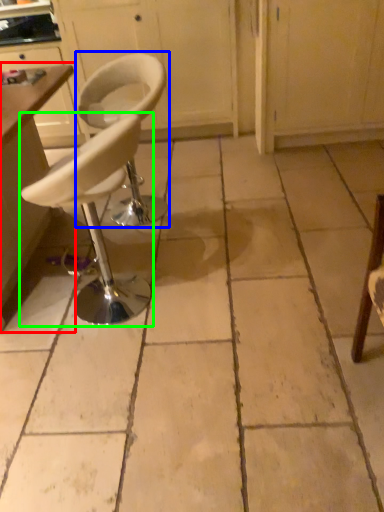
Question: Which object is positioned farthest from table (highlighted by a red box)? Select from chair (highlighted by a blue box) and chair (highlighted by a green box).

Choices:
 (A) chair
 (B) chair

Answer: (A)